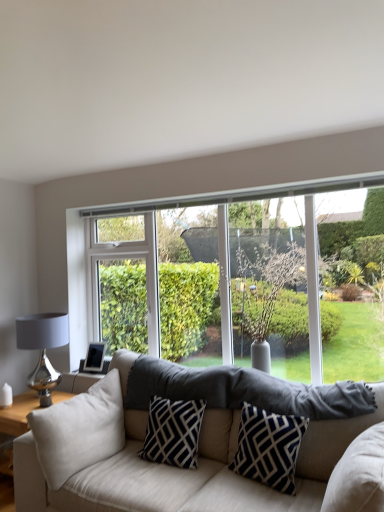
Where is `black/white geometric pillow at center, which is the second pillow from left to right`? The width and height of the screenshot is (384, 512). black/white geometric pillow at center, which is the second pillow from left to right is located at coordinates (173, 432).

Describe the element at coordinates (188, 471) in the screenshot. I see `beige fabric couch at center` at that location.

The height and width of the screenshot is (512, 384). Describe the element at coordinates (43, 349) in the screenshot. I see `shiny metallic table lamp at left` at that location.

Measure the distance between shiny metallic table lamp at left and camera.

They are 10.90 feet apart.

Describe the element at coordinates (304, 275) in the screenshot. I see `clear glass window at center` at that location.

Describe the element at coordinates (268, 447) in the screenshot. Image resolution: width=384 pixels, height=512 pixels. I see `navy blue/white geometric pillow at center, which appears as the 3th pillow when viewed from the left` at that location.

This screenshot has width=384, height=512. Find the location of `black/white geometric pillow at center, which is the second pillow from left to right`. black/white geometric pillow at center, which is the second pillow from left to right is located at coordinates (173, 432).

In the scene shown: Can you tell me how much black/white geometric pillow at center, the 2th pillow viewed from the right, and clear glass window at center differ in facing direction?

black/white geometric pillow at center, the 2th pillow viewed from the right, and clear glass window at center are facing 0.373 degrees away from each other.

From the image's perspective, which object appears higher, black/white geometric pillow at center, the 2th pillow viewed from the right, or clear glass window at center?

From the image's view, clear glass window at center is above.

From a real-world perspective, which is physically below, black/white geometric pillow at center, which is the second pillow from left to right, or clear glass window at center?

black/white geometric pillow at center, which is the second pillow from left to right.

Who is smaller, black/white geometric pillow at center, which is the second pillow from left to right, or clear glass window at center?

Smaller between the two is black/white geometric pillow at center, which is the second pillow from left to right.

Between navy blue/white geometric pillow at center, arranged as the 1th pillow when viewed from the right, and beige fabric couch at center, which one has more height?

beige fabric couch at center.

Is navy blue/white geometric pillow at center, which appears as the 3th pillow when viewed from the left, completely or partially outside of beige fabric couch at center?

Actually, navy blue/white geometric pillow at center, which appears as the 3th pillow when viewed from the left, is at least partially inside beige fabric couch at center.

You are a GUI agent. You are given a task and a screenshot of the screen. Output one action in this format:
    pyautogui.click(x=<x>, y=<y>)
    Task: Click on the 1st pillow behind the beige fabric couch at center
    
    Given the screenshot: What is the action you would take?
    pyautogui.click(x=268, y=447)

Is navy blue/white geometric pillow at center, arranged as the 1th pillow when viewed from the right, further to the viewer compared to beige fabric couch at center?

Yes, navy blue/white geometric pillow at center, arranged as the 1th pillow when viewed from the right, is further from the viewer.

Is black/white geometric pillow at center, which is the second pillow from left to right, oriented away from beige fabric pillow at lower left, the third pillow from the right?

black/white geometric pillow at center, which is the second pillow from left to right, does not have its back to beige fabric pillow at lower left, the third pillow from the right.

Looking at their sizes, would you say black/white geometric pillow at center, which is the second pillow from left to right, is wider or thinner than beige fabric pillow at lower left, the 1th pillow in the left-to-right sequence?

In the image, black/white geometric pillow at center, which is the second pillow from left to right, appears to be wider than beige fabric pillow at lower left, the 1th pillow in the left-to-right sequence.

How many degrees apart are the facing directions of black/white geometric pillow at center, the 2th pillow viewed from the right, and beige fabric pillow at lower left, the third pillow from the right?

They differ by 89 degrees in their facing directions.

In the image, there is a beige fabric pillow at lower left, the 1th pillow in the left-to-right sequence. At what (x,y) coordinates should I click in order to perform the action: click on pillow below it (from the image's perspective). Please return your answer as a coordinate pair (x, y). Looking at the image, I should click on (173, 432).

From a real-world perspective, is shiny metallic table lamp at left physically below clear glass window at center?

Yes, from a real-world perspective, shiny metallic table lamp at left is beneath clear glass window at center.

Considering the sizes of objects shiny metallic table lamp at left and clear glass window at center in the image provided, who is thinner, shiny metallic table lamp at left or clear glass window at center?

clear glass window at center.

Can we say shiny metallic table lamp at left lies outside clear glass window at center?

Yes, shiny metallic table lamp at left is located beyond the bounds of clear glass window at center.

Is clear glass window at center at the back of shiny metallic table lamp at left?

shiny metallic table lamp at left is not turned away from clear glass window at center.

Locate an element on the screen. The image size is (384, 512). pillow above the navy blue/white geometric pillow at center, arranged as the 1th pillow when viewed from the right (from a real-world perspective) is located at coordinates tap(79, 430).

Can you confirm if beige fabric pillow at lower left, the 1th pillow in the left-to-right sequence, is smaller than navy blue/white geometric pillow at center, arranged as the 1th pillow when viewed from the right?

No, beige fabric pillow at lower left, the 1th pillow in the left-to-right sequence, is not smaller than navy blue/white geometric pillow at center, arranged as the 1th pillow when viewed from the right.

In terms of width, does beige fabric pillow at lower left, the 1th pillow in the left-to-right sequence, look wider or thinner when compared to navy blue/white geometric pillow at center, arranged as the 1th pillow when viewed from the right?

Considering their sizes, beige fabric pillow at lower left, the 1th pillow in the left-to-right sequence, looks broader than navy blue/white geometric pillow at center, arranged as the 1th pillow when viewed from the right.

At what (x,y) coordinates should I click in order to perform the action: click on pillow that is the 1st one when counting upward from the beige fabric couch at center (from the image's perspective). Please return your answer as a coordinate pair (x, y). Looking at the image, I should click on (173, 432).

Is black/white geometric pillow at center, the 2th pillow viewed from the right, surrounding beige fabric couch at center?

No, black/white geometric pillow at center, the 2th pillow viewed from the right, does not contain beige fabric couch at center.

Is black/white geometric pillow at center, the 2th pillow viewed from the right, thinner than beige fabric couch at center?

Indeed, black/white geometric pillow at center, the 2th pillow viewed from the right, has a lesser width compared to beige fabric couch at center.

Are black/white geometric pillow at center, which is the second pillow from left to right, and beige fabric couch at center located far from each other?

No, black/white geometric pillow at center, which is the second pillow from left to right, is in close proximity to beige fabric couch at center.

Based on the photo, is navy blue/white geometric pillow at center, arranged as the 1th pillow when viewed from the right, spatially inside black/white geometric pillow at center, the 2th pillow viewed from the right, or outside of it?

navy blue/white geometric pillow at center, arranged as the 1th pillow when viewed from the right, exists outside the volume of black/white geometric pillow at center, the 2th pillow viewed from the right.

Which of these two, navy blue/white geometric pillow at center, which appears as the 3th pillow when viewed from the left, or black/white geometric pillow at center, the 2th pillow viewed from the right, stands taller?

navy blue/white geometric pillow at center, which appears as the 3th pillow when viewed from the left.

Where is `pillow that is the 2nd object located below the navy blue/white geometric pillow at center, arranged as the 1th pillow when viewed from the right (from the image's perspective)`? This screenshot has height=512, width=384. pillow that is the 2nd object located below the navy blue/white geometric pillow at center, arranged as the 1th pillow when viewed from the right (from the image's perspective) is located at coordinates (173, 432).

Considering the points (292, 426) and (190, 422), which point is behind, point (292, 426) or point (190, 422)?

The point (190, 422) is farther from the camera.

The image size is (384, 512). Find the location of `window above the black/white geometric pillow at center, which is the second pillow from left to right (from a real-world perspective)`. window above the black/white geometric pillow at center, which is the second pillow from left to right (from a real-world perspective) is located at coordinates (304, 275).

What are the coordinates of `studio couch lying below the navy blue/white geometric pillow at center, which appears as the 3th pillow when viewed from the left (from the image's perspective)` in the screenshot? It's located at coord(188,471).

Which object lies further to the anchor point beige fabric couch at center, beige fabric pillow at lower left, the 1th pillow in the left-to-right sequence, or navy blue/white geometric pillow at center, arranged as the 1th pillow when viewed from the right?

Among the two, navy blue/white geometric pillow at center, arranged as the 1th pillow when viewed from the right, is located further to beige fabric couch at center.

When comparing their distances from black/white geometric pillow at center, which is the second pillow from left to right, does beige fabric pillow at lower left, the 1th pillow in the left-to-right sequence, or beige fabric couch at center seem further?

beige fabric pillow at lower left, the 1th pillow in the left-to-right sequence, lies further to black/white geometric pillow at center, which is the second pillow from left to right, than the other object.

Looking at the image, which one is located further to black/white geometric pillow at center, which is the second pillow from left to right, clear glass window at center or beige fabric couch at center?

Among the two, clear glass window at center is located further to black/white geometric pillow at center, which is the second pillow from left to right.

When comparing their distances from beige fabric pillow at lower left, the 1th pillow in the left-to-right sequence, does beige fabric couch at center or clear glass window at center seem further?

The object further to beige fabric pillow at lower left, the 1th pillow in the left-to-right sequence, is clear glass window at center.

Estimate the real-world distances between objects in this image. Which object is closer to black/white geometric pillow at center, the 2th pillow viewed from the right, navy blue/white geometric pillow at center, arranged as the 1th pillow when viewed from the right, or beige fabric couch at center?

The object closer to black/white geometric pillow at center, the 2th pillow viewed from the right, is beige fabric couch at center.

From the image, which object appears to be nearer to navy blue/white geometric pillow at center, which appears as the 3th pillow when viewed from the left, black/white geometric pillow at center, the 2th pillow viewed from the right, or beige fabric pillow at lower left, the third pillow from the right?

Among the two, black/white geometric pillow at center, the 2th pillow viewed from the right, is located nearer to navy blue/white geometric pillow at center, which appears as the 3th pillow when viewed from the left.

Which object lies nearer to the anchor point shiny metallic table lamp at left, clear glass window at center or beige fabric pillow at lower left, the 1th pillow in the left-to-right sequence?

The object closer to shiny metallic table lamp at left is beige fabric pillow at lower left, the 1th pillow in the left-to-right sequence.

Estimate the real-world distances between objects in this image. Which object is closer to black/white geometric pillow at center, the 2th pillow viewed from the right, clear glass window at center or shiny metallic table lamp at left?

Among the two, clear glass window at center is located nearer to black/white geometric pillow at center, the 2th pillow viewed from the right.

I want to click on pillow between beige fabric pillow at lower left, the third pillow from the right, and navy blue/white geometric pillow at center, which appears as the 3th pillow when viewed from the left, in the horizontal direction, so click(x=173, y=432).

You are a GUI agent. You are given a task and a screenshot of the screen. Output one action in this format:
    pyautogui.click(x=<x>, y=<y>)
    Task: Click on the window between beige fabric couch at center and shiny metallic table lamp at left along the z-axis
    The height and width of the screenshot is (512, 384).
    Given the screenshot: What is the action you would take?
    pyautogui.click(x=304, y=275)

You are a GUI agent. You are given a task and a screenshot of the screen. Output one action in this format:
    pyautogui.click(x=<x>, y=<y>)
    Task: Click on the studio couch between beige fabric pillow at lower left, the 1th pillow in the left-to-right sequence, and navy blue/white geometric pillow at center, arranged as the 1th pillow when viewed from the right
    The height and width of the screenshot is (512, 384).
    Given the screenshot: What is the action you would take?
    pyautogui.click(x=188, y=471)

Locate an element on the screen. This screenshot has height=512, width=384. pillow between beige fabric pillow at lower left, the third pillow from the right, and shiny metallic table lamp at left from front to back is located at coordinates (173, 432).